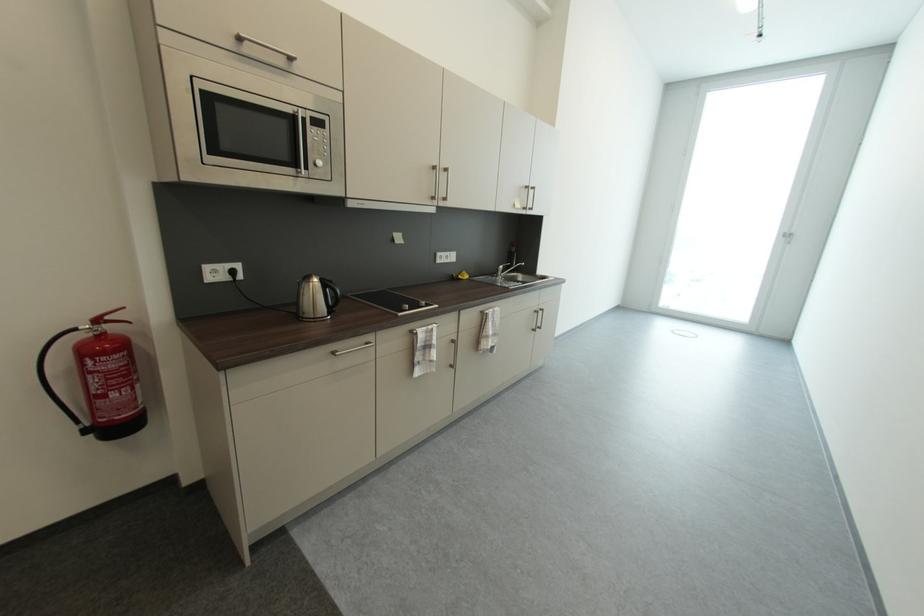
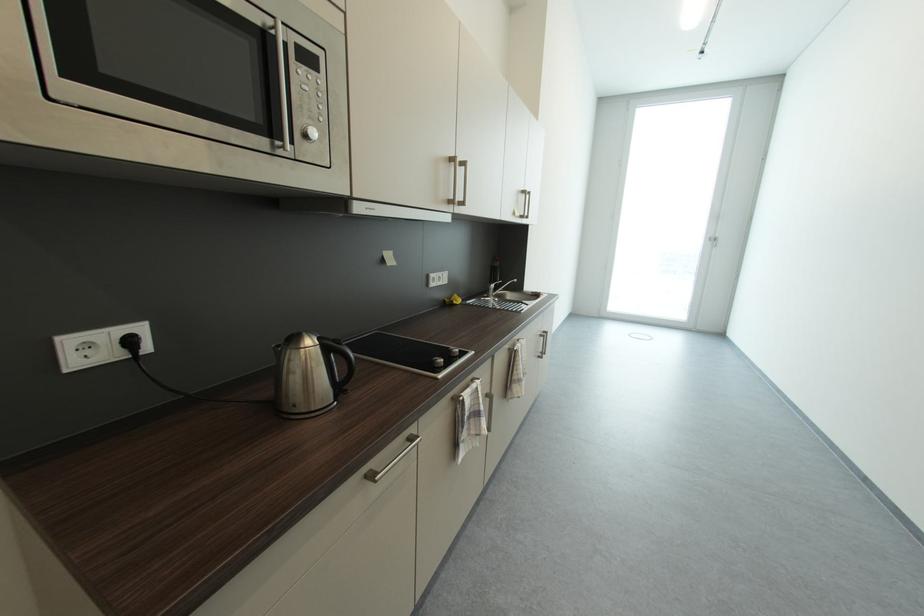
The point at (424, 347) is marked in the first image. Where is the corresponding point in the second image?

(472, 419)